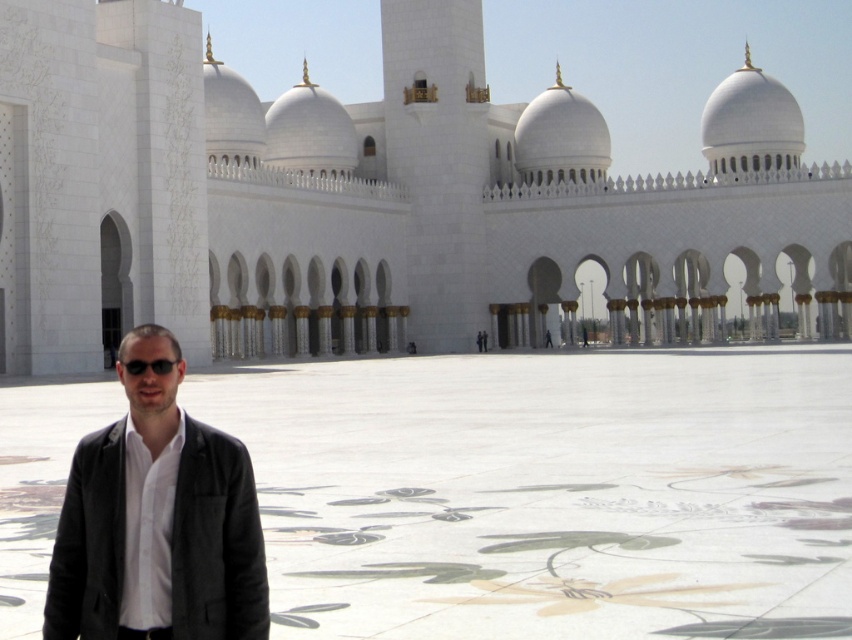
Can you confirm if white marble courtyard at center is smaller than black matte sunglasses at lower left?

No, white marble courtyard at center is not smaller than black matte sunglasses at lower left.

Which of these two, white marble courtyard at center or black matte sunglasses at lower left, stands taller?

With more height is white marble courtyard at center.

What do you see at coordinates (550, 492) in the screenshot? The image size is (852, 640). I see `white marble courtyard at center` at bounding box center [550, 492].

I want to click on white marble courtyard at center, so click(x=550, y=492).

Is white marble mosque at center to the left of black matte sunglasses at lower left from the viewer's perspective?

Incorrect, white marble mosque at center is not on the left side of black matte sunglasses at lower left.

Is white marble mosque at center below black matte sunglasses at lower left?

Incorrect, white marble mosque at center is not positioned below black matte sunglasses at lower left.

Which is in front, point (0, 6) or point (154, 372)?

Point (154, 372)

Where is `white marble mosque at center`? white marble mosque at center is located at coordinates (373, 200).

Between point (413, 250) and point (331, 545), which one is positioned in front?

Positioned in front is point (331, 545).

Does white marble mosque at center appear over white marble courtyard at center?

Correct, white marble mosque at center is located above white marble courtyard at center.

At what (x,y) coordinates should I click in order to perform the action: click on white marble mosque at center. Please return your answer as a coordinate pair (x, y). Image resolution: width=852 pixels, height=640 pixels. Looking at the image, I should click on (373, 200).